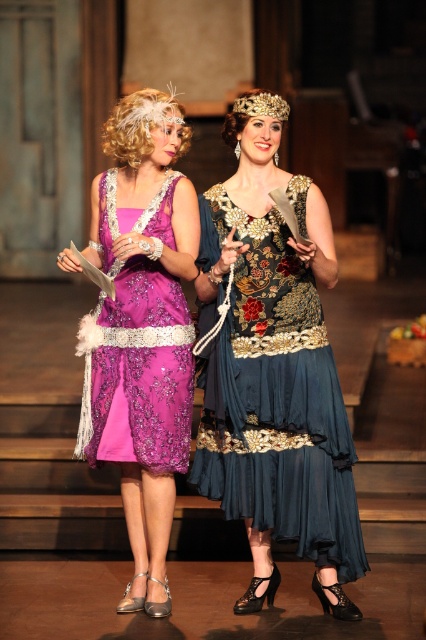
Is velvet blue dress at center smaller than matte purple dress at center?

Yes, velvet blue dress at center is smaller than matte purple dress at center.

Does velvet blue dress at center appear on the right side of matte purple dress at center?

Correct, you'll find velvet blue dress at center to the right of matte purple dress at center.

The width and height of the screenshot is (426, 640). Identify the location of velvet blue dress at center. (276, 397).

Who is taller, matte purple dress at center or purple satin dress at center?

Standing taller between the two is matte purple dress at center.

At what (x,y) coordinates should I click in order to perform the action: click on matte purple dress at center. Please return your answer as a coordinate pair (x, y). Image resolution: width=426 pixels, height=640 pixels. Looking at the image, I should click on (144, 326).

Does velvet blue dress at center have a greater width compared to purple satin dress at center?

Indeed, velvet blue dress at center has a greater width compared to purple satin dress at center.

Who is lower down, velvet blue dress at center or purple satin dress at center?

velvet blue dress at center is lower down.

Image resolution: width=426 pixels, height=640 pixels. What are the coordinates of `velvet blue dress at center` in the screenshot? It's located at (276, 397).